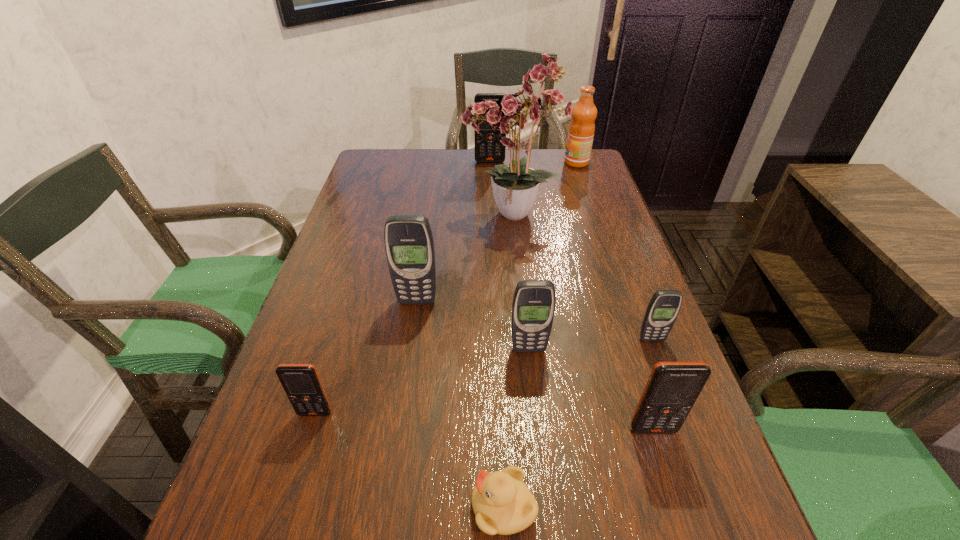
Where is `blank region between the flower arrangement and the fifth farthest object`? Image resolution: width=960 pixels, height=540 pixels. blank region between the flower arrangement and the fifth farthest object is located at coordinates (581, 278).

This screenshot has height=540, width=960. Identify the location of vacant space that is in between the biggest orange cellular telephone and the second biggest orange cellular telephone. (571, 295).

Image resolution: width=960 pixels, height=540 pixels. Identify the location of free space between the second nearest object and the second object from left to right. (535, 365).

At what (x,y) coordinates should I click in order to perform the action: click on free point between the leftmost gray cellular telephone and the second smallest gray cellular telephone. Please return your answer as a coordinate pair (x, y). Image resolution: width=960 pixels, height=540 pixels. Looking at the image, I should click on (473, 325).

Identify the location of vacant space in between the smallest orange cellular telephone and the flower arrangement. Image resolution: width=960 pixels, height=540 pixels. (413, 314).

The image size is (960, 540). I want to click on object that is the fourth closest one to the second farthest gray cellular telephone, so click(502, 503).

Find the location of a particular element. object that is the sixth closest to the third nearest cellular telephone is located at coordinates (515, 187).

The image size is (960, 540). In order to click on cellular telephone identified as the fifth closest to the fruit juice in this screenshot , I will do `click(672, 389)`.

Select which cellular telephone appears as the second closest to the third farthest object. Please provide its 2D coordinates. Your answer should be formatted as a tuple, i.e. [(x, y)], where the tuple contains the x and y coordinates of a point satisfying the conditions above.

[(409, 245)]

Locate which orange cellular telephone is the third closest to the fourth nearest object. Please provide its 2D coordinates. Your answer should be formatted as a tuple, i.e. [(x, y)], where the tuple contains the x and y coordinates of a point satisfying the conditions above.

[(485, 147)]